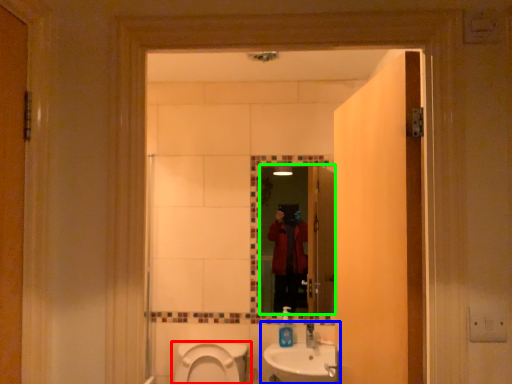
Question: Which is farther away from toilet (highlighted by a red box)? sink (highlighted by a blue box) or mirror (highlighted by a green box)?

Choices:
 (A) sink
 (B) mirror

Answer: (B)